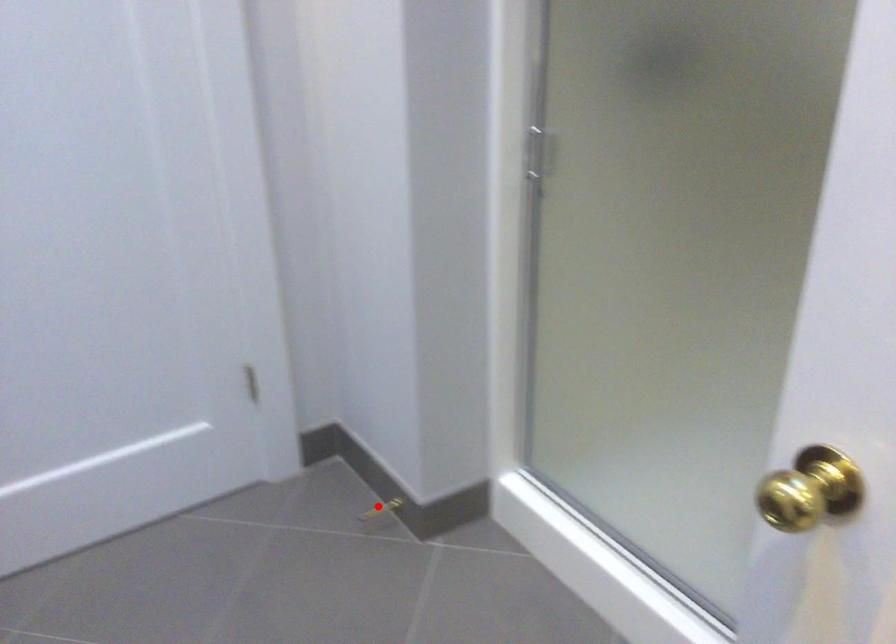
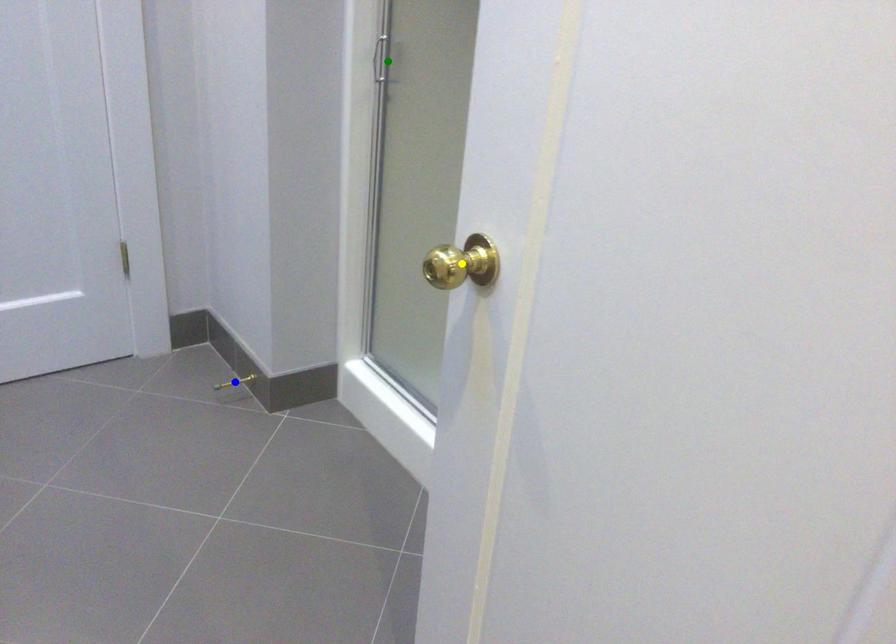
Question: I am providing you with two images of the same scene from different viewpoints. A red point is marked on the first image. You are given multiple points on the second image. Which point in image 2 represents the same 3d spot as the red point in image 1?

Choices:
 (A) blue point
 (B) yellow point
 (C) green point

Answer: (A)